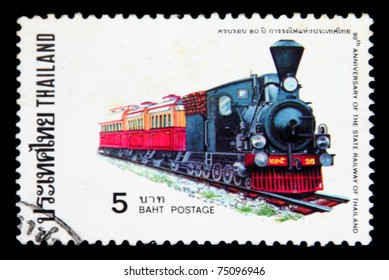
Find the location of `windows`. windows is located at coordinates (227, 105), (169, 118), (163, 121), (156, 122), (151, 123), (138, 123), (116, 126), (110, 128).